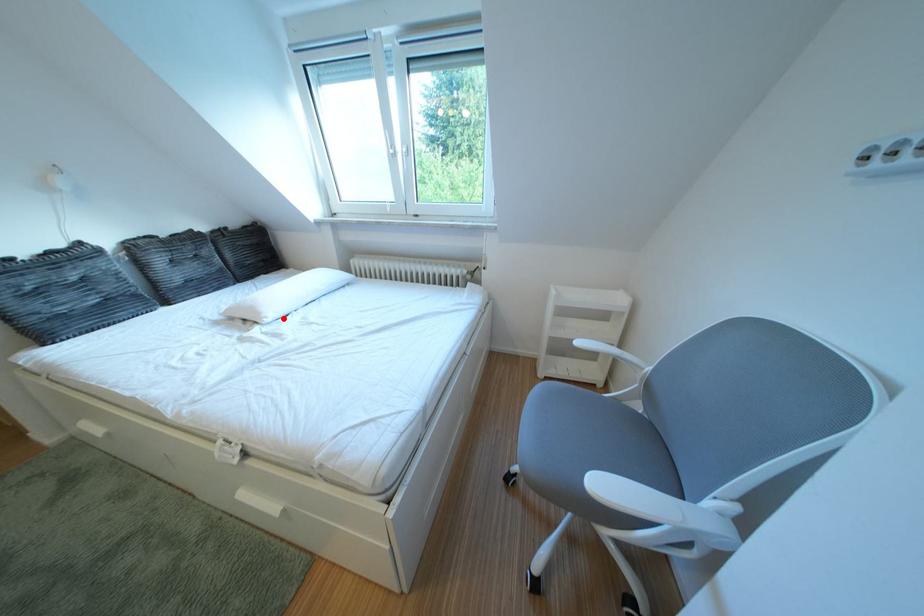
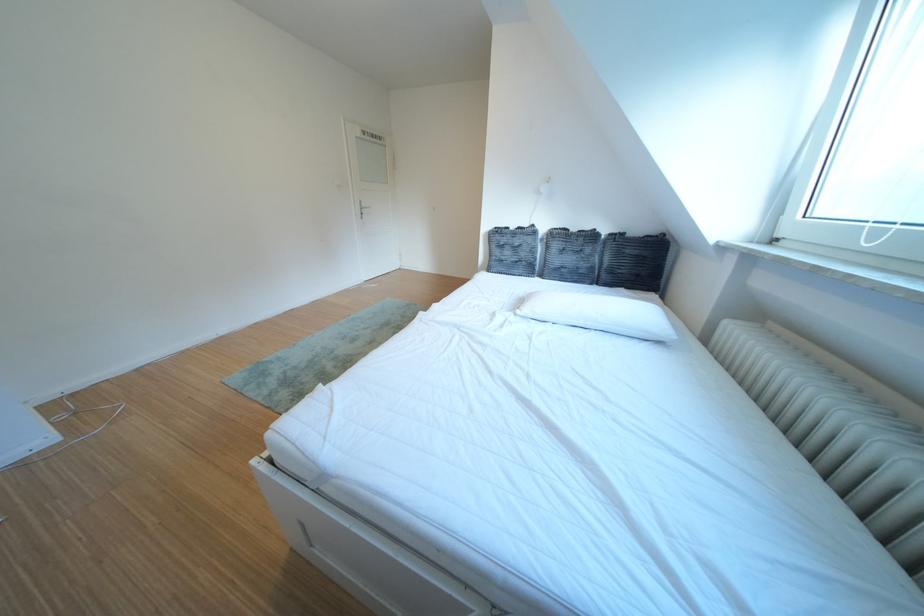
Locate, in the second image, the point that corresponds to the highlighted location in the first image.

(540, 314)